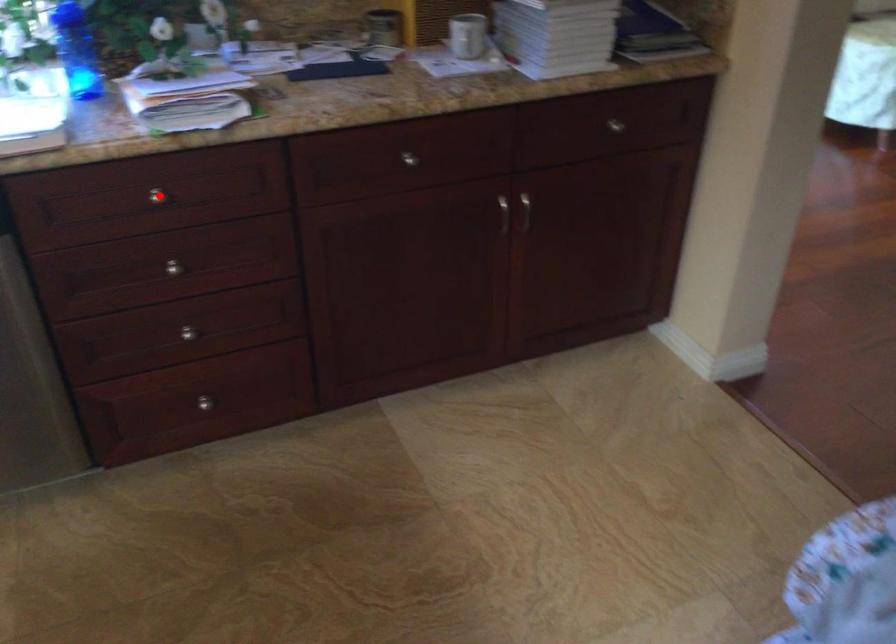
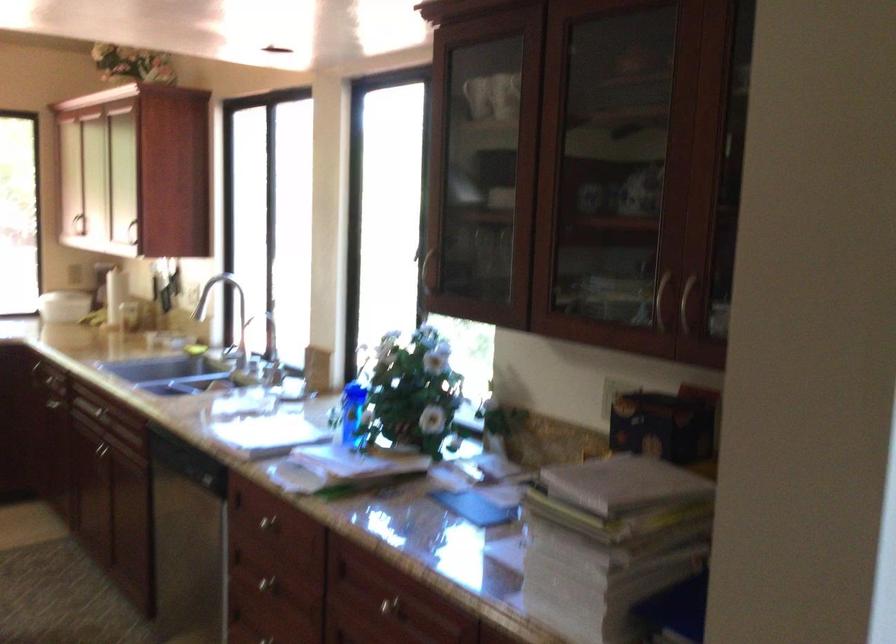
Where in the second image is the point corresponding to the highlighted location from the first image?

(268, 522)